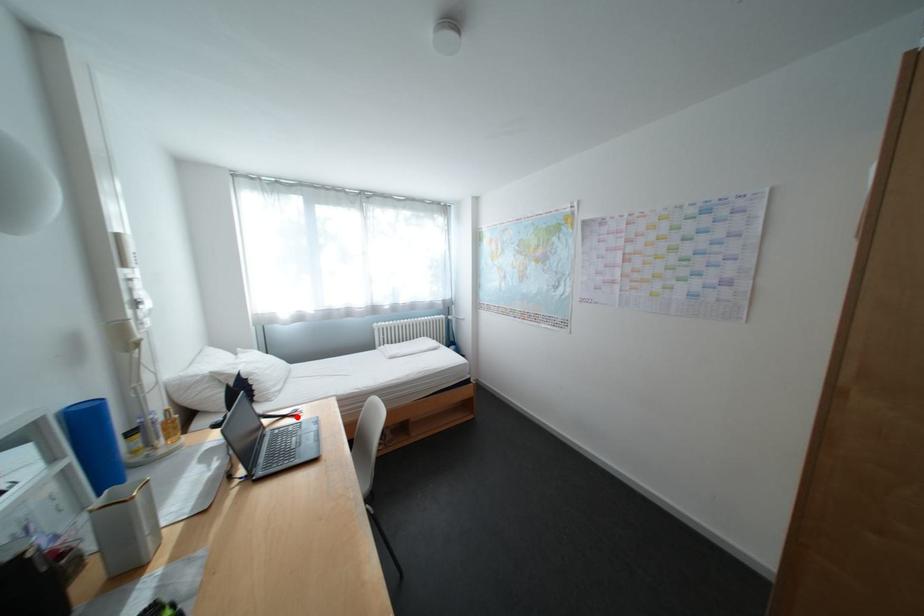
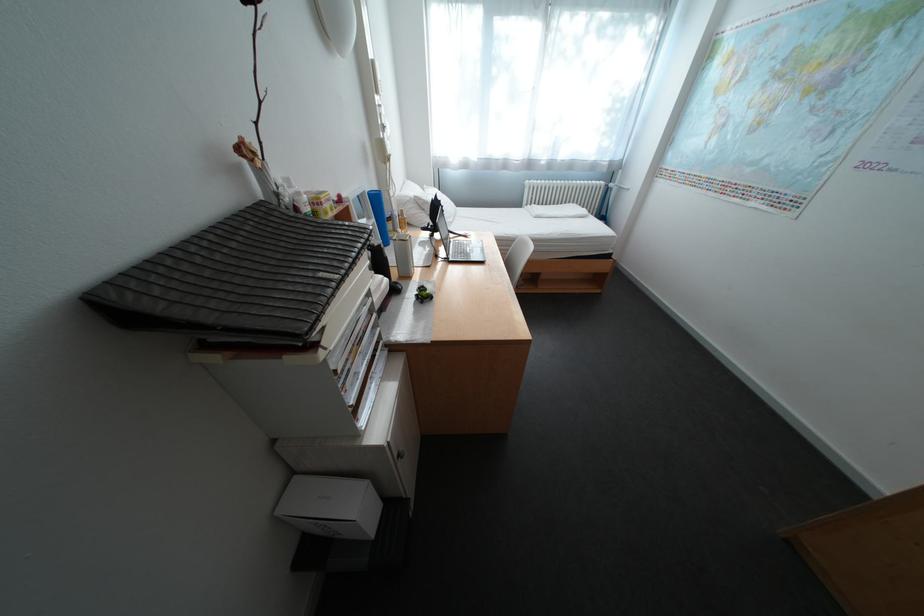
Find the pixel in the second image that matches the highlighted location in the first image.

(472, 236)